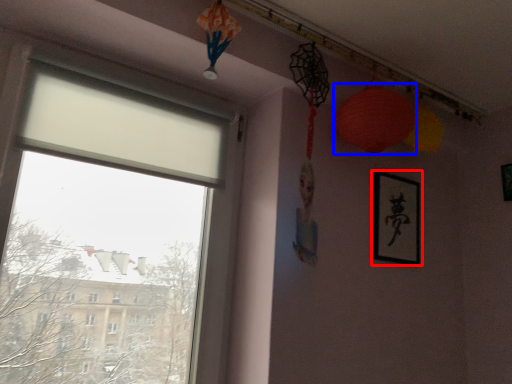
Question: Which object is closer to the camera taking this photo, picture frame (highlighted by a red box) or lantern (highlighted by a blue box)?

Choices:
 (A) picture frame
 (B) lantern

Answer: (B)